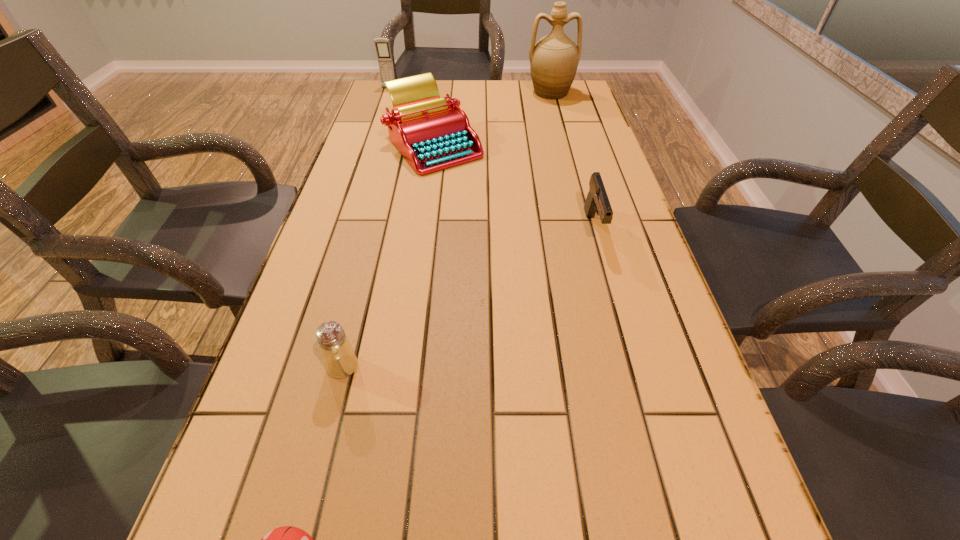
In the image, there is a desktop. Where is `vacant space at the far edge`? The width and height of the screenshot is (960, 540). vacant space at the far edge is located at coordinates (501, 98).

In the image, there is a desktop. Where is `vacant space at the left edge`? The width and height of the screenshot is (960, 540). vacant space at the left edge is located at coordinates (310, 409).

This screenshot has width=960, height=540. What are the coordinates of `vacant space at the right edge of the desktop` in the screenshot? It's located at (626, 461).

Find the location of a particular element. This screenshot has width=960, height=540. vacant space at the far right corner of the desktop is located at coordinates (561, 100).

I want to click on blank region between the third farthest object and the saltshaker, so click(389, 256).

Locate an element on the screen. Image resolution: width=960 pixels, height=540 pixels. free space that is in between the tallest object and the cellular telephone is located at coordinates (469, 90).

Where is `free space between the tallest object and the fifth farthest object`? The width and height of the screenshot is (960, 540). free space between the tallest object and the fifth farthest object is located at coordinates (446, 230).

Locate an element on the screen. This screenshot has height=540, width=960. empty location between the third farthest object and the pistol is located at coordinates (514, 186).

In order to click on vacant space that's between the third nearest object and the typewriter in this screenshot , I will do `click(514, 186)`.

Locate an element on the screen. The width and height of the screenshot is (960, 540). object that is the fifth nearest to the pistol is located at coordinates (382, 45).